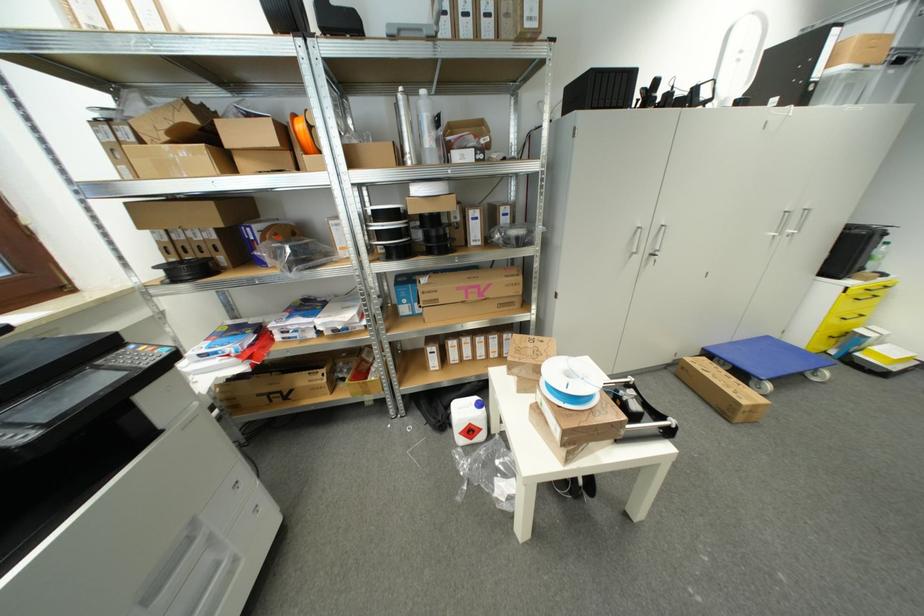
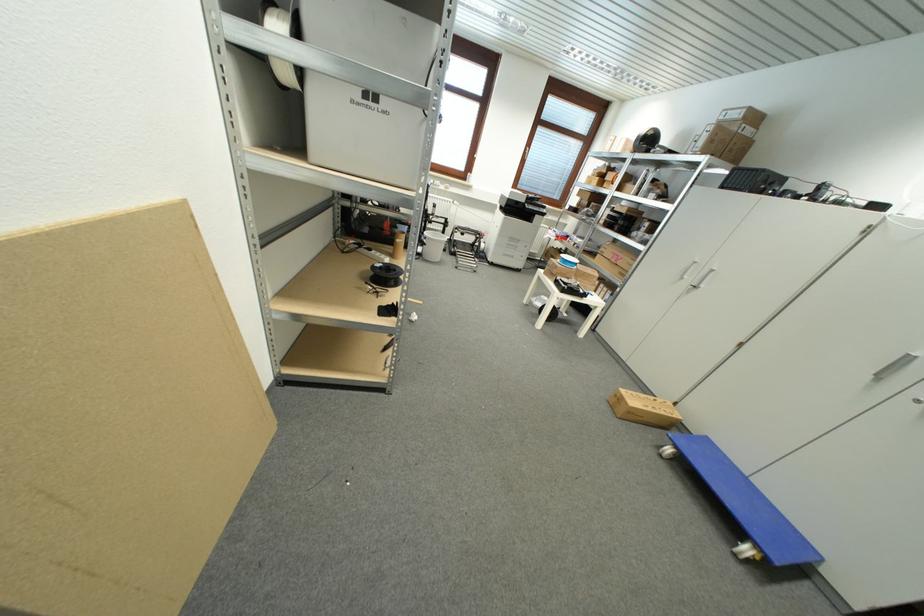
In the second image, find the point that corresponds to point 708,352 in the first image.

(711, 440)